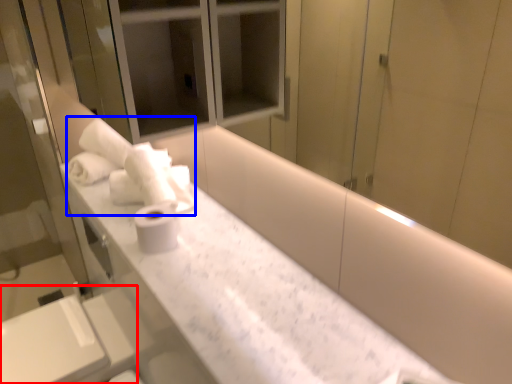
Question: Which object appears farthest to the camera in this image, sink (highlighted by a red box) or bath towel (highlighted by a blue box)?

Choices:
 (A) sink
 (B) bath towel

Answer: (B)